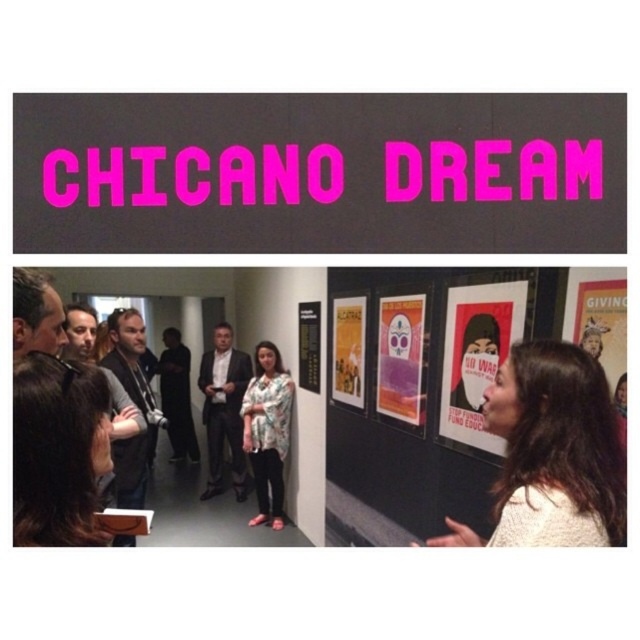
Does pink matte sign at upper center come behind gold metallic poster at center?

No, pink matte sign at upper center is closer to the viewer.

Is pink matte sign at upper center bigger than gold metallic poster at center?

No, pink matte sign at upper center is not bigger than gold metallic poster at center.

Where is `pink matte sign at upper center`? This screenshot has height=640, width=640. pink matte sign at upper center is located at coordinates (320, 172).

Where is `pink matte sign at upper center`? pink matte sign at upper center is located at coordinates (320, 172).

Does point (225, 108) lie behind point (616, 458)?

No, (225, 108) is in front of (616, 458).

Does point (184, 134) lie behind point (506, 534)?

No.

You are a GUI agent. You are given a task and a screenshot of the screen. Output one action in this format:
    pyautogui.click(x=<x>, y=<y>)
    Task: Click on the pink matte sign at upper center
    The image size is (640, 640).
    Given the screenshot: What is the action you would take?
    pyautogui.click(x=320, y=172)

Does matte paper poster at center have a lesser width compared to matte purple poster at center?

Correct, matte paper poster at center's width is less than matte purple poster at center's.

Between matte paper poster at center and matte purple poster at center, which one has less height?

matte paper poster at center

Is point (600, 285) farther from camera compared to point (403, 388)?

No, it is not.

You are a GUI agent. You are given a task and a screenshot of the screen. Output one action in this format:
    pyautogui.click(x=<x>, y=<y>)
    Task: Click on the matte paper poster at center
    The image size is (640, 640).
    Given the screenshot: What is the action you would take?
    pyautogui.click(x=600, y=321)